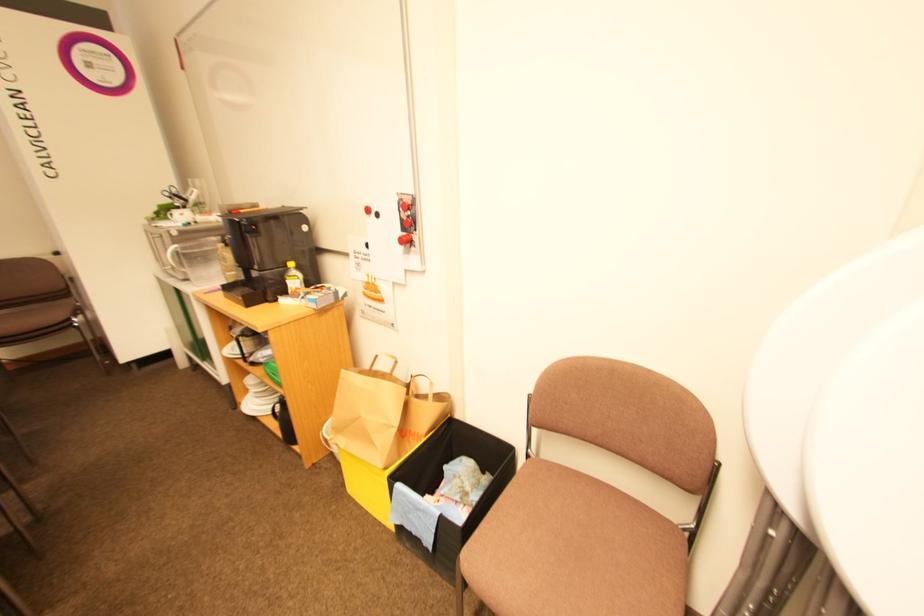
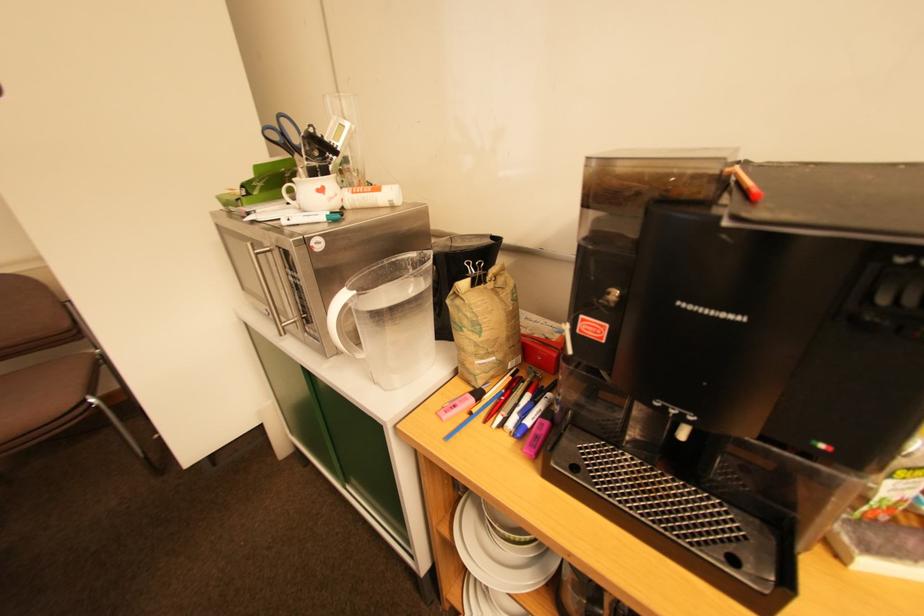
In a continuous first-person perspective shot, in which direction is the camera moving?

The movement direction of the cameraman is left, forward.